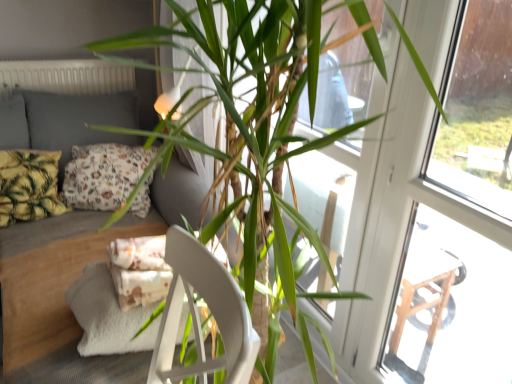
Question: From the image's perspective, is transparent glass screen door at upper right above or below white matte radiator at upper left?

Choices:
 (A) above
 (B) below

Answer: (B)

Question: Based on their positions, is transparent glass screen door at upper right located to the left or right of white matte radiator at upper left?

Choices:
 (A) left
 (B) right

Answer: (B)

Question: Estimate the real-world distances between objects in this image. Which object is farther from the white matte radiator at upper left?

Choices:
 (A) gray fabric couch at left
 (B) floral fabric pillow at left, the first pillow viewed from the right
 (C) yellow-green leafy fabric pillow at left, acting as the 1th pillow starting from the left
 (D) transparent glass screen door at upper right

Answer: (D)

Question: Which object is the closest to the yellow-green leafy fabric pillow at left, acting as the 1th pillow starting from the left?

Choices:
 (A) transparent glass screen door at upper right
 (B) white matte radiator at upper left
 (C) floral fabric pillow at left, the first pillow viewed from the right
 (D) gray fabric couch at left

Answer: (C)